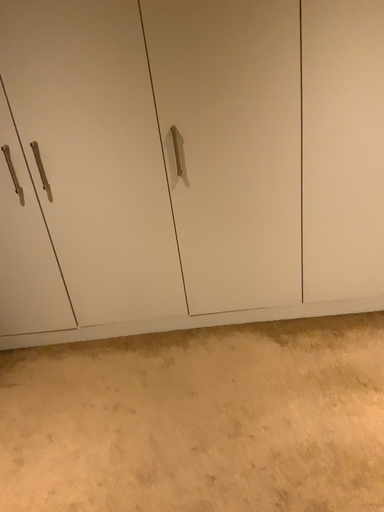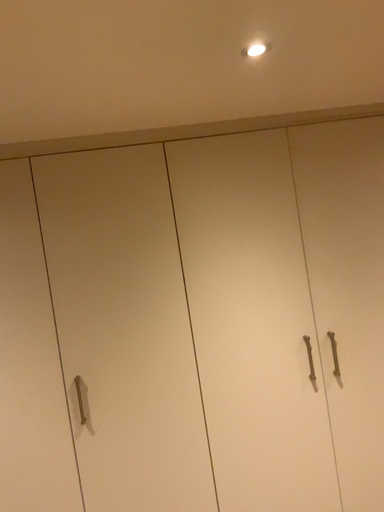
Question: How did the camera likely rotate when shooting the video?

Choices:
 (A) rotated upward
 (B) rotated downward

Answer: (A)